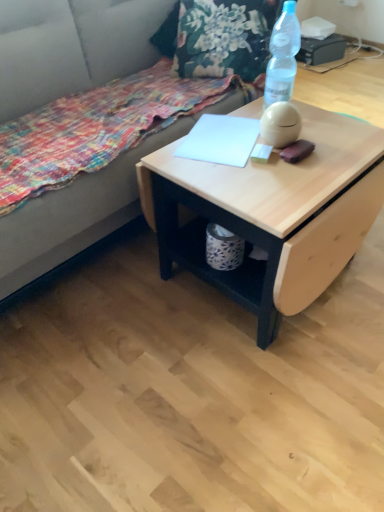
This screenshot has height=512, width=384. In order to click on blank area beneath white paper at center (from a real-world perspective) in this screenshot , I will do `click(225, 144)`.